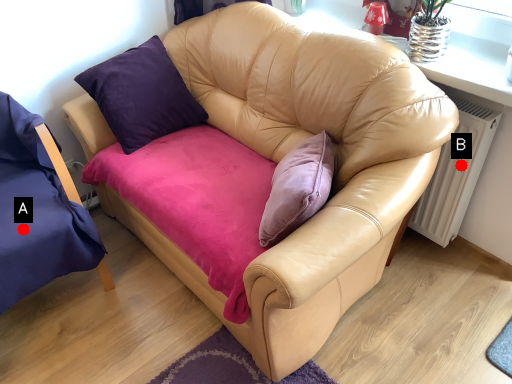
Question: Two points are circled on the image, labeled by A and B beside each circle. Which point appears closest to the camera in this image?

Choices:
 (A) A is closer
 (B) B is closer

Answer: (A)